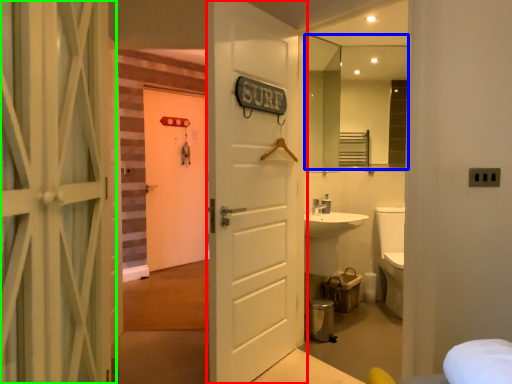
Question: Considering the real-world distances, which object is closest to door (highlighted by a red box)? mirror (highlighted by a blue box) or door (highlighted by a green box).

Choices:
 (A) mirror
 (B) door

Answer: (B)